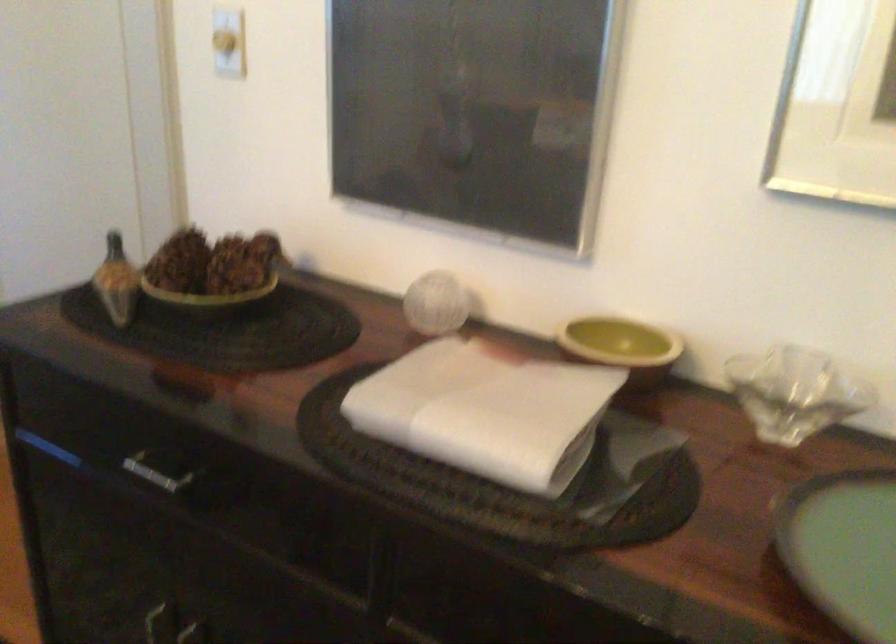
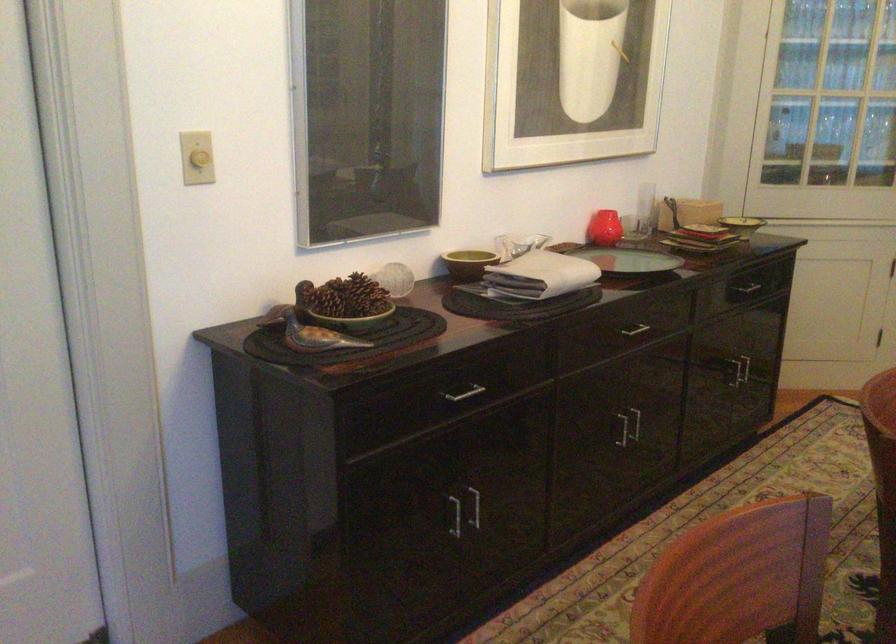
In the second image, find the point that corresponds to the point at 573,313 in the first image.

(468, 263)